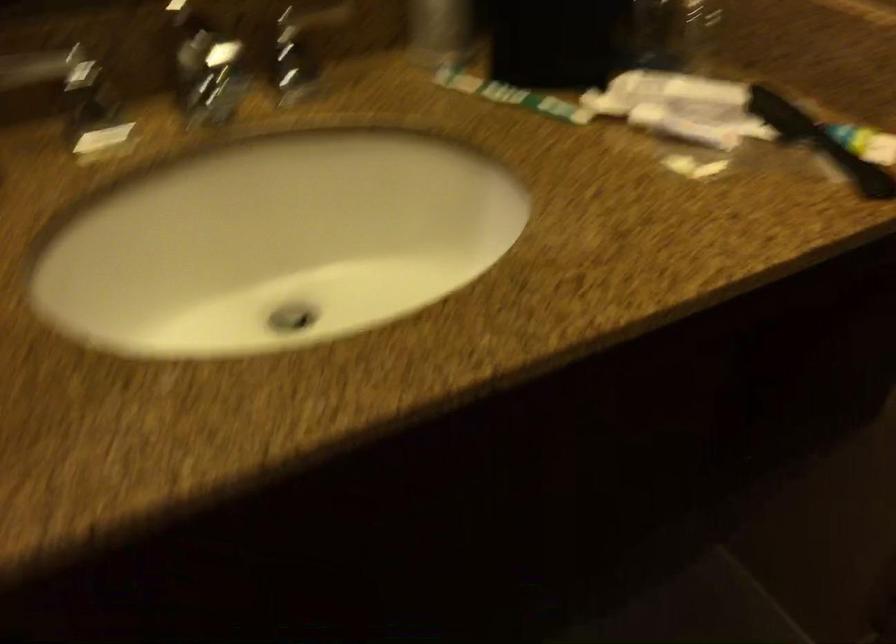
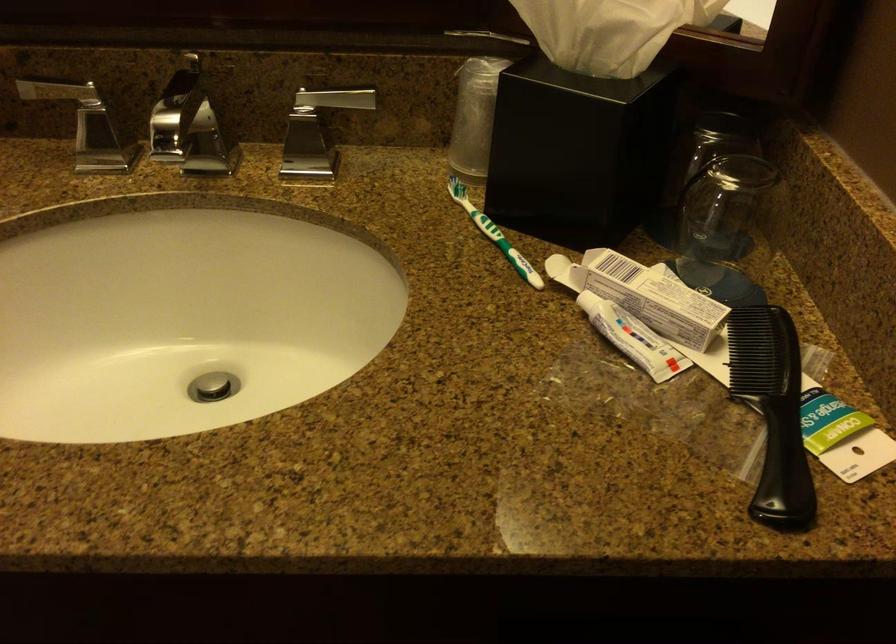
Locate, in the second image, the point that corresponds to the point at 819,138 in the first image.

(772, 411)